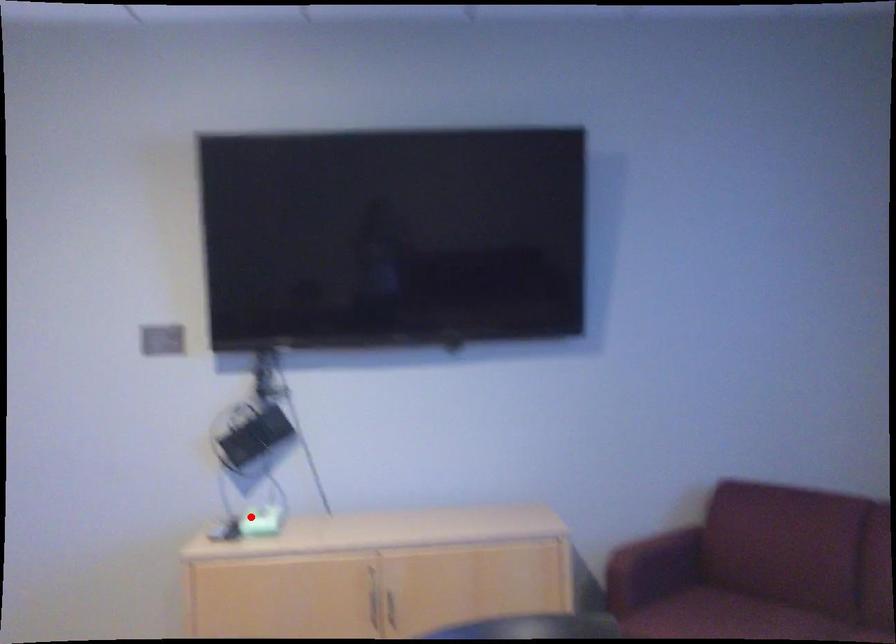
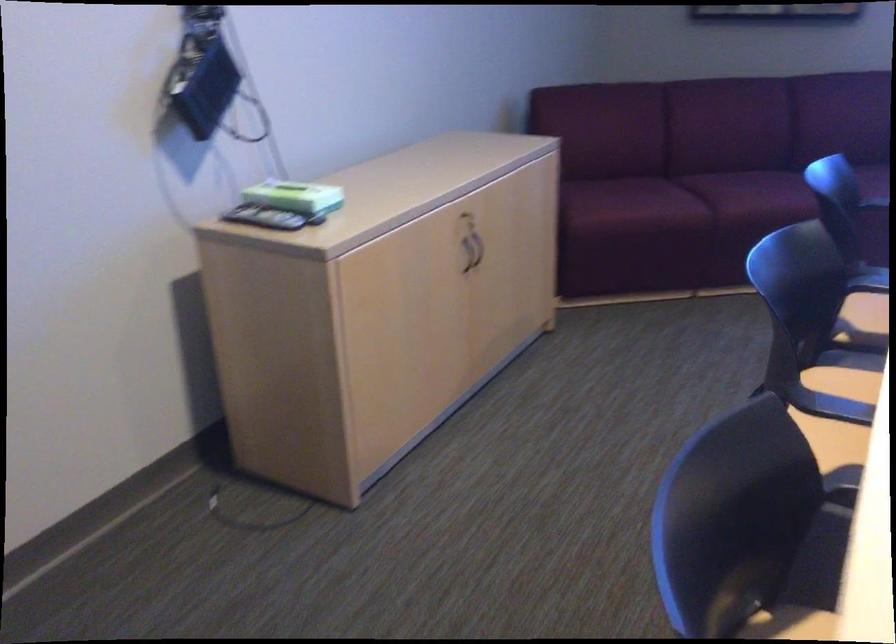
Find the pixel in the second image that matches the highlighted location in the first image.

(287, 196)